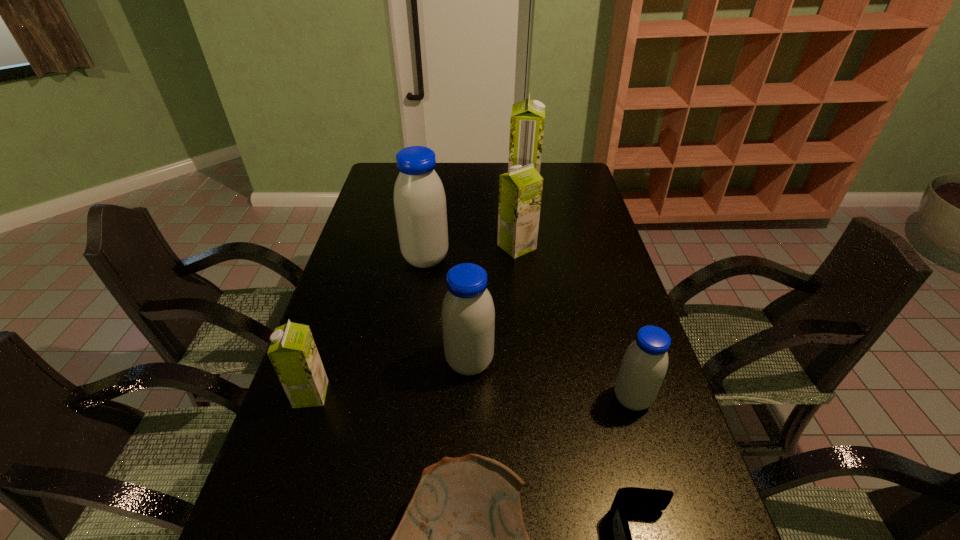
This screenshot has width=960, height=540. What are the coordinates of `the farthest green soya milk` in the screenshot? It's located at (527, 120).

This screenshot has width=960, height=540. Find the location of `the biggest green soya milk`. the biggest green soya milk is located at coordinates (527, 120).

This screenshot has width=960, height=540. What are the coordinates of `the fifth soya milk from right to left` in the screenshot? It's located at click(419, 198).

Find the location of `the leftmost blue soya milk`. the leftmost blue soya milk is located at coordinates (419, 198).

Where is `the second smallest green soya milk`? the second smallest green soya milk is located at coordinates (520, 190).

Locate an element on the screen. the second blue soya milk from left to right is located at coordinates click(x=468, y=315).

Where is `the second biggest blue soya milk`? the second biggest blue soya milk is located at coordinates (468, 315).

Locate an element on the screen. The width and height of the screenshot is (960, 540). the leftmost soya milk is located at coordinates (293, 353).

Identify the location of the nearest green soya milk. The image size is (960, 540). (293, 353).

At what (x,y) coordinates should I click in order to perform the action: click on the rightmost blue soya milk. Please return your answer as a coordinate pair (x, y). This screenshot has height=540, width=960. Looking at the image, I should click on (644, 365).